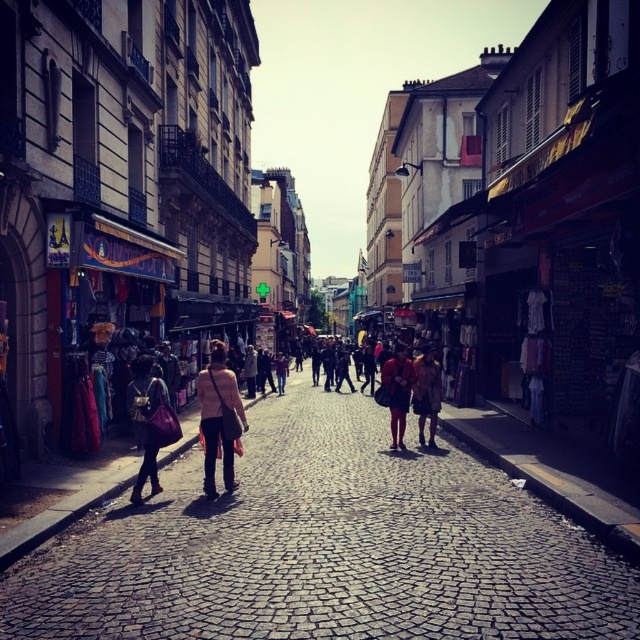
Consider the image. You are a tourist standing on the cobblestone street and see the light pink fabric jacket at center. If you want to buy a souvenir from the shop with the sign reading

The light pink fabric jacket at center is located at point (218, 419), which is in the center of the scene. Since the souvenir shop is on the left side of the street, you should move towards the left to reach it.

You are a traveler standing on the cobblestone street in front of the shops. You see a light pink fabric jacket at center and a matte pink bag at center. Which item is shorter in height?

The light pink fabric jacket at center is not as tall as the matte pink bag at center, so the light pink fabric jacket at center is shorter in height.

You are standing at point A with coordinates point A at (225, 483). You want to walk to point B which is 10.60 meters away from you. Is there enough space to walk straight to point B without any obstacles?

Yes, there is enough space to walk straight to point B without any obstacles because the distance between them is 10.60 meters and there are no mentioned obstacles in the scene description.